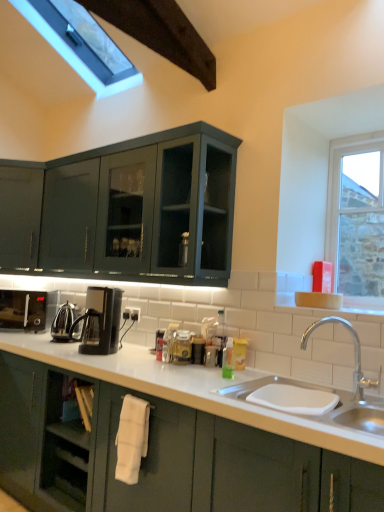
Question: Should I look upward or downward to see polished stainless steel kettle at center-left, marked as the second appliance in a front-to-back arrangement?

Choices:
 (A) up
 (B) down

Answer: (B)

Question: From a real-world perspective, is white fabric towel at lower center located beneath white ceramic sink at lower center?

Choices:
 (A) yes
 (B) no

Answer: (A)

Question: Is white fabric towel at lower center smaller than white ceramic sink at lower center?

Choices:
 (A) yes
 (B) no

Answer: (A)

Question: Considering the relative sizes of white fabric towel at lower center and white ceramic sink at lower center in the image provided, is white fabric towel at lower center shorter than white ceramic sink at lower center?

Choices:
 (A) yes
 (B) no

Answer: (B)

Question: Is white fabric towel at lower center taller than white ceramic sink at lower center?

Choices:
 (A) yes
 (B) no

Answer: (A)

Question: Is white fabric towel at lower center far from white ceramic sink at lower center?

Choices:
 (A) yes
 (B) no

Answer: (B)

Question: From the image's perspective, does white fabric towel at lower center appear lower than white ceramic sink at lower center?

Choices:
 (A) no
 (B) yes

Answer: (B)

Question: Considering the relative sizes of white glossy sink at lower right and black plastic coffee machine at center, the first coffee machine viewed from the front, in the image provided, is white glossy sink at lower right bigger than black plastic coffee machine at center, the first coffee machine viewed from the front,?

Choices:
 (A) yes
 (B) no

Answer: (A)

Question: Is white glossy sink at lower right closer to the viewer compared to black plastic coffee machine at center, the first coffee machine viewed from the front?

Choices:
 (A) yes
 (B) no

Answer: (A)

Question: Is black plastic coffee machine at center, the first coffee machine viewed from the front, at the back of white glossy sink at lower right?

Choices:
 (A) yes
 (B) no

Answer: (B)

Question: Is white glossy sink at lower right next to black plastic coffee machine at center, acting as the second coffee machine starting from the left, and touching it?

Choices:
 (A) no
 (B) yes

Answer: (A)

Question: Is white glossy sink at lower right smaller than black plastic coffee machine at center, marked as the second coffee machine in a back-to-front arrangement?

Choices:
 (A) no
 (B) yes

Answer: (A)

Question: Does white glossy sink at lower right have a lesser height compared to black plastic coffee machine at center, marked as the second coffee machine in a back-to-front arrangement?

Choices:
 (A) no
 (B) yes

Answer: (A)

Question: Is black plastic coffee machine at lower left, acting as the first coffee machine starting from the left, positioned with its back to white glossy sink at lower right?

Choices:
 (A) yes
 (B) no

Answer: (B)